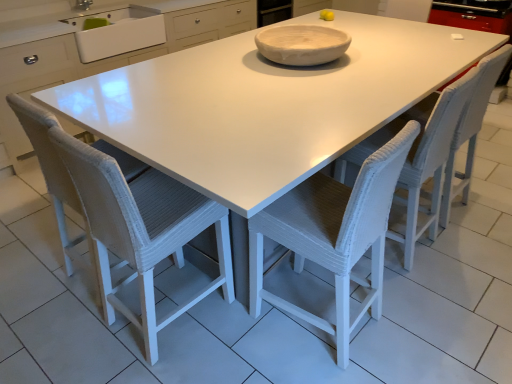
Question: Is white woven chair at center, which is the first chair from left to right, completely or partially inside white matte bowl at center?

Choices:
 (A) no
 (B) yes

Answer: (A)

Question: Is white matte bowl at center taller than white woven chair at center, which appears as the third chair when viewed from the right?

Choices:
 (A) no
 (B) yes

Answer: (A)

Question: Is white matte bowl at center placed right next to white woven chair at center, which appears as the third chair when viewed from the right?

Choices:
 (A) no
 (B) yes

Answer: (A)

Question: Is white matte bowl at center smaller than white woven chair at center, which appears as the third chair when viewed from the right?

Choices:
 (A) yes
 (B) no

Answer: (A)

Question: Is white matte bowl at center positioned before white woven chair at center, which is the first chair from left to right?

Choices:
 (A) yes
 (B) no

Answer: (B)

Question: From a real-world perspective, relative to white woven chair at center, the 1th chair when ordered from right to left, is white woven chair at center, which is the first chair from left to right, vertically above or below?

Choices:
 (A) below
 (B) above

Answer: (B)

Question: Choose the correct answer: Is white woven chair at center, which appears as the third chair when viewed from the right, inside white woven chair at center, which is the third chair in left-to-right order, or outside it?

Choices:
 (A) outside
 (B) inside

Answer: (A)

Question: From the image's perspective, is white woven chair at center, which appears as the third chair when viewed from the right, located above or below white woven chair at center, the 1th chair when ordered from right to left?

Choices:
 (A) below
 (B) above

Answer: (A)

Question: Considering the positions of white woven chair at center, which appears as the third chair when viewed from the right, and white woven chair at center, which is the third chair in left-to-right order, in the image, is white woven chair at center, which appears as the third chair when viewed from the right, wider or thinner than white woven chair at center, which is the third chair in left-to-right order,?

Choices:
 (A) thin
 (B) wide

Answer: (B)

Question: Considering their positions, is white ceramic sink at upper left located in front of or behind white woven chair at center, which is the first chair from left to right?

Choices:
 (A) front
 (B) behind

Answer: (B)

Question: From their relative heights in the image, would you say white ceramic sink at upper left is taller or shorter than white woven chair at center, which appears as the third chair when viewed from the right?

Choices:
 (A) short
 (B) tall

Answer: (A)

Question: Is white ceramic sink at upper left bigger or smaller than white woven chair at center, which is the first chair from left to right?

Choices:
 (A) big
 (B) small

Answer: (B)

Question: Considering the positions of point (113, 56) and point (164, 228), is point (113, 56) closer or farther from the camera than point (164, 228)?

Choices:
 (A) farther
 (B) closer

Answer: (A)

Question: Does point (257, 36) appear closer or farther from the camera than point (47, 158)?

Choices:
 (A) farther
 (B) closer

Answer: (A)

Question: Would you say white matte bowl at center is to the left or to the right of white woven swivel chair at lower left in the picture?

Choices:
 (A) left
 (B) right

Answer: (B)